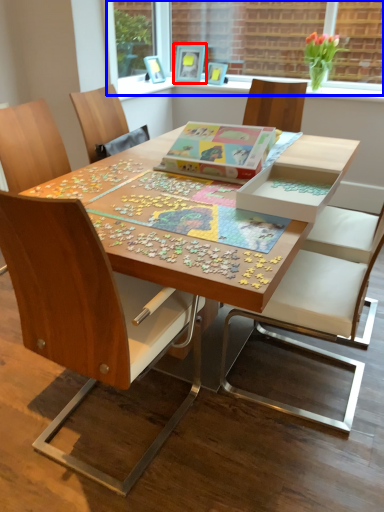
Question: Which point is further to the camera, picture frame (highlighted by a red box) or window screen (highlighted by a blue box)?

Choices:
 (A) picture frame
 (B) window screen

Answer: (A)